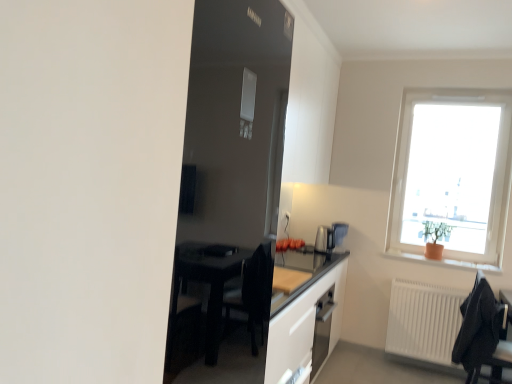
Question: From a real-world perspective, is white matte radiator at lower right positioned over black fabric chair at lower right based on gravity?

Choices:
 (A) no
 (B) yes

Answer: (A)

Question: Is white matte radiator at lower right facing towards black fabric chair at lower right?

Choices:
 (A) no
 (B) yes

Answer: (B)

Question: Is white matte radiator at lower right positioned with its back to black fabric chair at lower right?

Choices:
 (A) no
 (B) yes

Answer: (A)

Question: Does white matte radiator at lower right appear on the left side of black fabric chair at lower right?

Choices:
 (A) no
 (B) yes

Answer: (B)

Question: Is white matte radiator at lower right next to black fabric chair at lower right and touching it?

Choices:
 (A) yes
 (B) no

Answer: (B)

Question: Is the depth of white matte radiator at lower right greater than that of black fabric chair at lower right?

Choices:
 (A) no
 (B) yes

Answer: (B)

Question: Could white matte radiator at lower right be considered to be inside satin metallic coffee machine at right?

Choices:
 (A) no
 (B) yes

Answer: (A)

Question: Is satin metallic coffee machine at right at the right side of white matte radiator at lower right?

Choices:
 (A) no
 (B) yes

Answer: (A)

Question: Does satin metallic coffee machine at right lie behind white matte radiator at lower right?

Choices:
 (A) no
 (B) yes

Answer: (B)

Question: From the image's perspective, is satin metallic coffee machine at right below white matte radiator at lower right?

Choices:
 (A) yes
 (B) no

Answer: (B)

Question: Is satin metallic coffee machine at right positioned far away from white matte radiator at lower right?

Choices:
 (A) no
 (B) yes

Answer: (A)

Question: Does satin metallic coffee machine at right touch white matte radiator at lower right?

Choices:
 (A) no
 (B) yes

Answer: (A)

Question: Is orange clay pot at right closer to the viewer compared to transparent glass window at upper right?

Choices:
 (A) yes
 (B) no

Answer: (A)